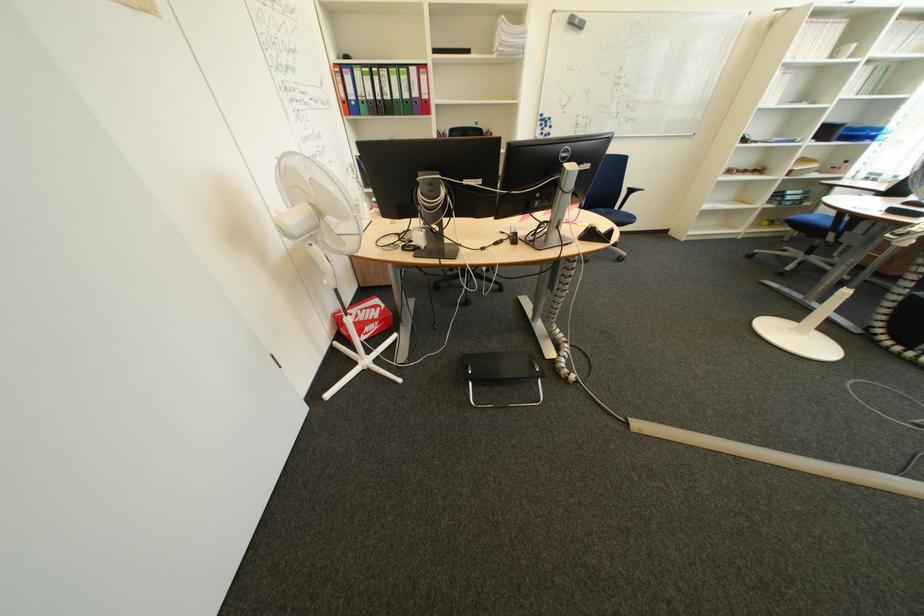
Identify the location of whiteboard eraser. Image resolution: width=924 pixels, height=616 pixels. (576, 21).